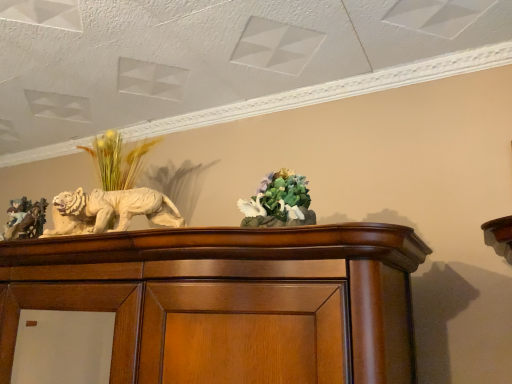
Where is `green matte floral arrangement at center`? green matte floral arrangement at center is located at coordinates (279, 202).

Identify the location of white glossy sculpture at left. (110, 211).

Does point (148, 219) come closer to viewer compared to point (39, 226)?

Yes, point (148, 219) is closer to viewer.

From the image's perspective, would you say white glossy sculpture at left is shown under matte brown figurine at left?

No, from the image's perspective, white glossy sculpture at left is not below matte brown figurine at left.

What are the coordinates of `lion that appears below the matte brown figurine at left (from a real-world perspective)` in the screenshot? It's located at (110, 211).

Considering the sizes of white glossy sculpture at left and matte brown figurine at left in the image, is white glossy sculpture at left wider or thinner than matte brown figurine at left?

In the image, white glossy sculpture at left appears to be wider than matte brown figurine at left.

From the picture: From the image's perspective, is matte brown figurine at left over white glossy sculpture at left?

Incorrect, from the image's perspective, matte brown figurine at left is lower than white glossy sculpture at left.

Does matte brown figurine at left come behind white glossy sculpture at left?

Yes, matte brown figurine at left is behind white glossy sculpture at left.

Can you confirm if matte brown figurine at left is positioned to the left of white glossy sculpture at left?

Yes, matte brown figurine at left is to the left of white glossy sculpture at left.

How different are the orientations of green matte floral arrangement at center and white glossy sculpture at left in degrees?

3.61 degrees.

In the image, there is a white glossy sculpture at left. At what (x,y) coordinates should I click in order to perform the action: click on flower above it (from the image's perspective). Please return your answer as a coordinate pair (x, y). Looking at the image, I should click on (279, 202).

Considering the positions of objects green matte floral arrangement at center and white glossy sculpture at left in the image provided, who is more to the left, green matte floral arrangement at center or white glossy sculpture at left?

Positioned to the left is white glossy sculpture at left.

Between green matte floral arrangement at center and white glossy sculpture at left, which one has more height?

green matte floral arrangement at center.

Considering their positions, is white glossy sculpture at left located in front of or behind green matte floral arrangement at center?

white glossy sculpture at left is behind green matte floral arrangement at center.

Based on the photo, from the image's perspective, which is above, white glossy sculpture at left or green matte floral arrangement at center?

green matte floral arrangement at center, from the image's perspective.

Can we say white glossy sculpture at left lies outside green matte floral arrangement at center?

Yes, white glossy sculpture at left is outside of green matte floral arrangement at center.

Could you tell me if white glossy sculpture at left is facing green matte floral arrangement at center?

No, white glossy sculpture at left is not oriented towards green matte floral arrangement at center.

Is matte brown figurine at left situated inside green matte floral arrangement at center or outside?

matte brown figurine at left is not inside green matte floral arrangement at center, it's outside.

Find the location of a particular element. flower that is under the matte brown figurine at left (from a real-world perspective) is located at coordinates (279, 202).

From a real-world perspective, is matte brown figurine at left below green matte floral arrangement at center?

No, from a real-world perspective, matte brown figurine at left is not beneath green matte floral arrangement at center.

From a real-world perspective, is green matte floral arrangement at center on matte brown figurine at left?

No, from a real-world perspective, green matte floral arrangement at center is not over matte brown figurine at left

From the image's perspective, who appears lower, green matte floral arrangement at center or matte brown figurine at left?

matte brown figurine at left.

Considering the sizes of green matte floral arrangement at center and matte brown figurine at left in the image, is green matte floral arrangement at center bigger or smaller than matte brown figurine at left?

In the image, green matte floral arrangement at center appears to be smaller than matte brown figurine at left.

The height and width of the screenshot is (384, 512). What are the coordinates of `lion located on the right of matte brown figurine at left` in the screenshot? It's located at (110, 211).

Where is `lion located underneath the matte brown figurine at left (from a real-world perspective)`? lion located underneath the matte brown figurine at left (from a real-world perspective) is located at coordinates (110, 211).

From the image, which object appears to be nearer to green matte floral arrangement at center, matte brown figurine at left or white glossy sculpture at left?

white glossy sculpture at left is closer to green matte floral arrangement at center.

In the scene shown: Based on their spatial positions, is matte brown figurine at left or green matte floral arrangement at center further from white glossy sculpture at left?

Based on the image, green matte floral arrangement at center appears to be further to white glossy sculpture at left.

When comparing their distances from green matte floral arrangement at center, does white glossy sculpture at left or matte brown figurine at left seem further?

The object further to green matte floral arrangement at center is matte brown figurine at left.

From the image, which object appears to be farther from matte brown figurine at left, green matte floral arrangement at center or white glossy sculpture at left?

Based on the image, green matte floral arrangement at center appears to be further to matte brown figurine at left.

Looking at the image, which one is located further to matte brown figurine at left, white glossy sculpture at left or green matte floral arrangement at center?

Based on the image, green matte floral arrangement at center appears to be further to matte brown figurine at left.

From the image, which object appears to be nearer to white glossy sculpture at left, green matte floral arrangement at center or matte brown figurine at left?

Among the two, matte brown figurine at left is located nearer to white glossy sculpture at left.

Find the location of a particular element. The height and width of the screenshot is (384, 512). lion between matte brown figurine at left and green matte floral arrangement at center from left to right is located at coordinates pyautogui.click(x=110, y=211).